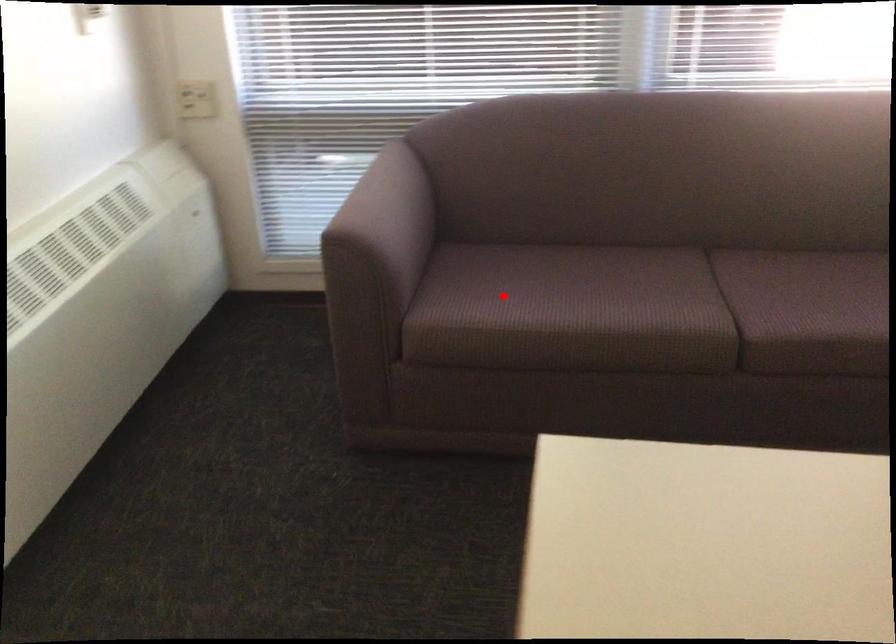
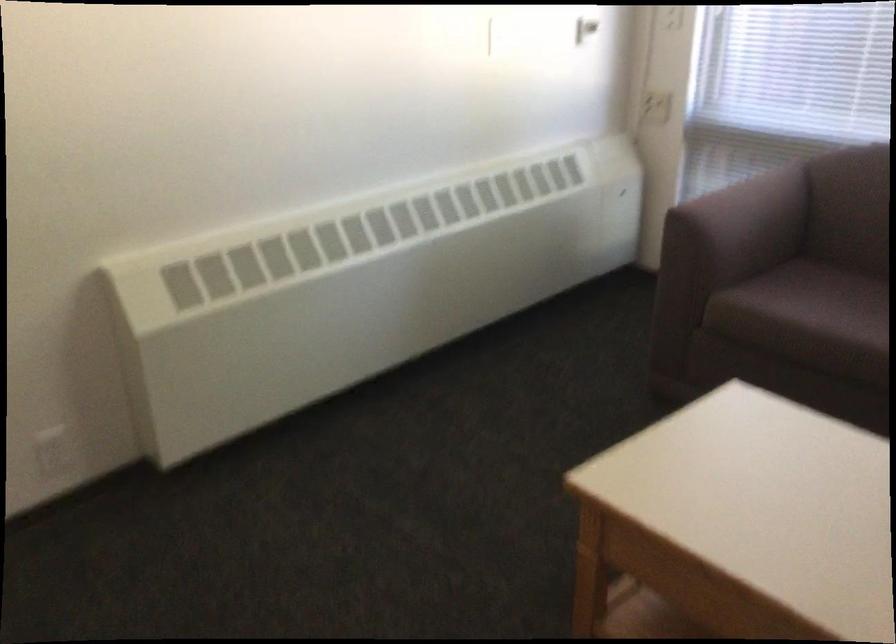
Locate, in the second image, the point that corresponds to the highlighted location in the first image.

(807, 303)